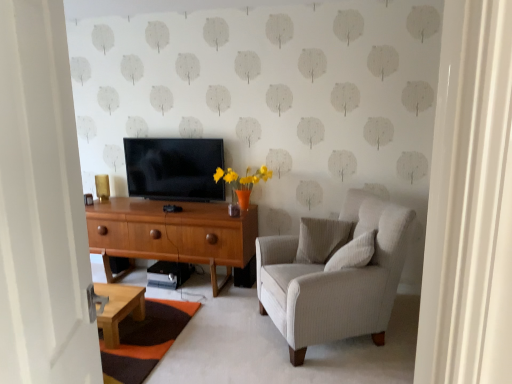
Question: Does white wooden door at left turn towards white textured pillow at center, arranged as the 1th pillow when viewed from the back?

Choices:
 (A) yes
 (B) no

Answer: (B)

Question: Can you confirm if white wooden door at left is taller than white textured pillow at center, arranged as the 1th pillow when viewed from the back?

Choices:
 (A) no
 (B) yes

Answer: (B)

Question: Is white wooden door at left at the left side of white textured pillow at center, acting as the 2th pillow starting from the front?

Choices:
 (A) yes
 (B) no

Answer: (A)

Question: Is white wooden door at left outside white textured pillow at center, acting as the 2th pillow starting from the front?

Choices:
 (A) yes
 (B) no

Answer: (A)

Question: From the image's perspective, would you say white wooden door at left is positioned over white textured pillow at center, arranged as the 1th pillow when viewed from the back?

Choices:
 (A) no
 (B) yes

Answer: (B)

Question: Do you think white wooden door at left is within white textured pillow at center, acting as the 2th pillow starting from the front, or outside of it?

Choices:
 (A) inside
 (B) outside

Answer: (B)

Question: In terms of width, does white wooden door at left look wider or thinner when compared to white textured pillow at center, arranged as the 1th pillow when viewed from the back?

Choices:
 (A) wide
 (B) thin

Answer: (B)

Question: Is white wooden door at left in front of or behind white textured pillow at center, acting as the 2th pillow starting from the front, in the image?

Choices:
 (A) behind
 (B) front

Answer: (B)

Question: From a real-world perspective, is white wooden door at left positioned above or below white textured pillow at center, arranged as the 1th pillow when viewed from the back?

Choices:
 (A) above
 (B) below

Answer: (A)

Question: From a real-world perspective, is white wooden door at left positioned above or below flat screen tv at center?

Choices:
 (A) below
 (B) above

Answer: (B)

Question: From the image's perspective, relative to flat screen tv at center, is white wooden door at left above or below?

Choices:
 (A) above
 (B) below

Answer: (B)

Question: Is white wooden door at left to the left or to the right of flat screen tv at center in the image?

Choices:
 (A) left
 (B) right

Answer: (B)

Question: Considering the positions of white wooden door at left and flat screen tv at center in the image, is white wooden door at left wider or thinner than flat screen tv at center?

Choices:
 (A) thin
 (B) wide

Answer: (B)

Question: From a real-world perspective, is white textured pillow at center, the 1th pillow in the front-to-back sequence, physically located above or below white wooden door at left?

Choices:
 (A) below
 (B) above

Answer: (A)

Question: Is white textured pillow at center, the 1th pillow in the front-to-back sequence, bigger or smaller than white wooden door at left?

Choices:
 (A) big
 (B) small

Answer: (B)